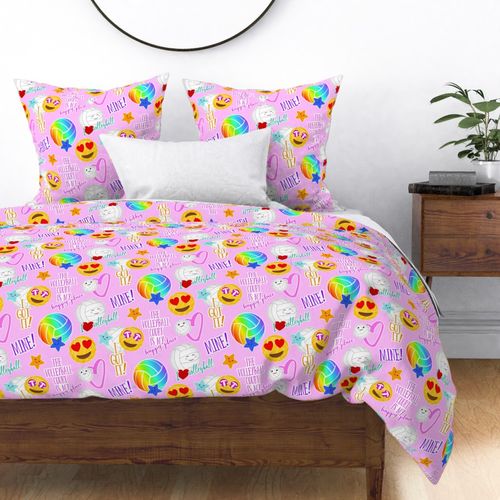
Identify the location of round mirro. Image resolution: width=500 pixels, height=500 pixels. (155, 30).